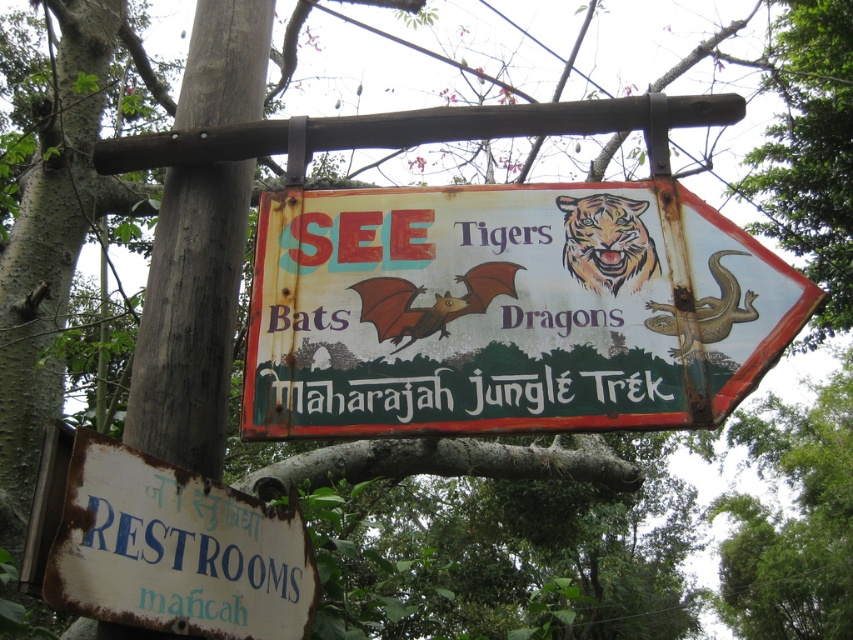
Question: Which point is farther to the camera?

Choices:
 (A) (277, 513)
 (B) (405, 413)

Answer: (A)

Question: Is rusty metal sign at center bigger than rusty white signboard at lower left?

Choices:
 (A) no
 (B) yes

Answer: (B)

Question: Does rusty metal sign at center appear over rusty white signboard at lower left?

Choices:
 (A) no
 (B) yes

Answer: (B)

Question: Which object is farther from the camera taking this photo?

Choices:
 (A) white painted text at center
 (B) rusty white signboard at lower left
 (C) rusty metal sign at center

Answer: (A)

Question: Estimate the real-world distances between objects in this image. Which object is closer to the rusty metal sign at center?

Choices:
 (A) white painted text at center
 (B) rusty white signboard at lower left

Answer: (A)

Question: Is rusty white signboard at lower left bigger than white painted text at center?

Choices:
 (A) yes
 (B) no

Answer: (A)